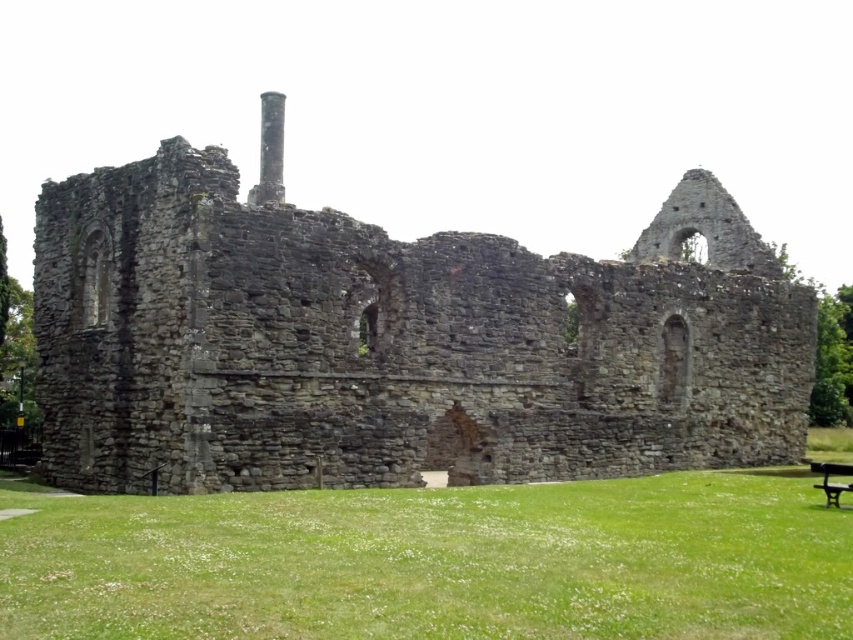
Who is positioned more to the left, green grass at lower center or black wooden bench at lower right?

Positioned to the left is green grass at lower center.

Can you confirm if green grass at lower center is bigger than black wooden bench at lower right?

Yes.

Does point (73, 582) lie behind point (834, 492)?

No, it is not.

Identify the location of green grass at lower center. The height and width of the screenshot is (640, 853). (437, 561).

Which is more to the right, rusty stone ruins at center or black wooden bench at lower right?

From the viewer's perspective, black wooden bench at lower right appears more on the right side.

Which is in front, point (718, 202) or point (845, 465)?

Point (845, 465) is more forward.

You are a GUI agent. You are given a task and a screenshot of the screen. Output one action in this format:
    pyautogui.click(x=<x>, y=<y>)
    Task: Click on the rusty stone ruins at center
    The height and width of the screenshot is (640, 853).
    Given the screenshot: What is the action you would take?
    pyautogui.click(x=393, y=340)

Which is more to the left, rusty stone ruins at center or green grass at lower center?

From the viewer's perspective, green grass at lower center appears more on the left side.

Does rusty stone ruins at center appear over green grass at lower center?

Indeed, rusty stone ruins at center is positioned over green grass at lower center.

The width and height of the screenshot is (853, 640). I want to click on rusty stone ruins at center, so click(393, 340).